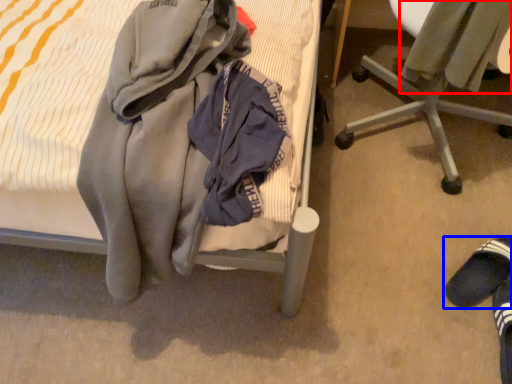
Question: Which point is further to the camera, sweater (highlighted by a red box) or footwear (highlighted by a blue box)?

Choices:
 (A) sweater
 (B) footwear

Answer: (B)